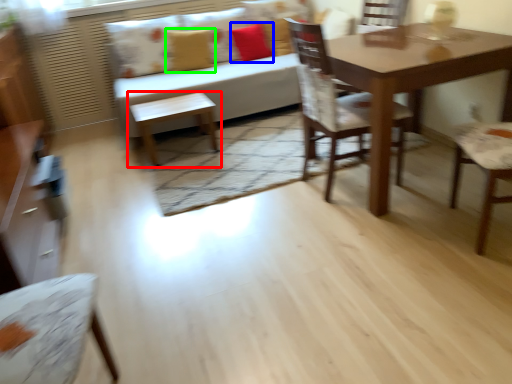
Question: Which object is the closest to the table (highlighted by a red box)? Choose among these: pillow (highlighted by a blue box) or pillow (highlighted by a green box).

Choices:
 (A) pillow
 (B) pillow

Answer: (B)